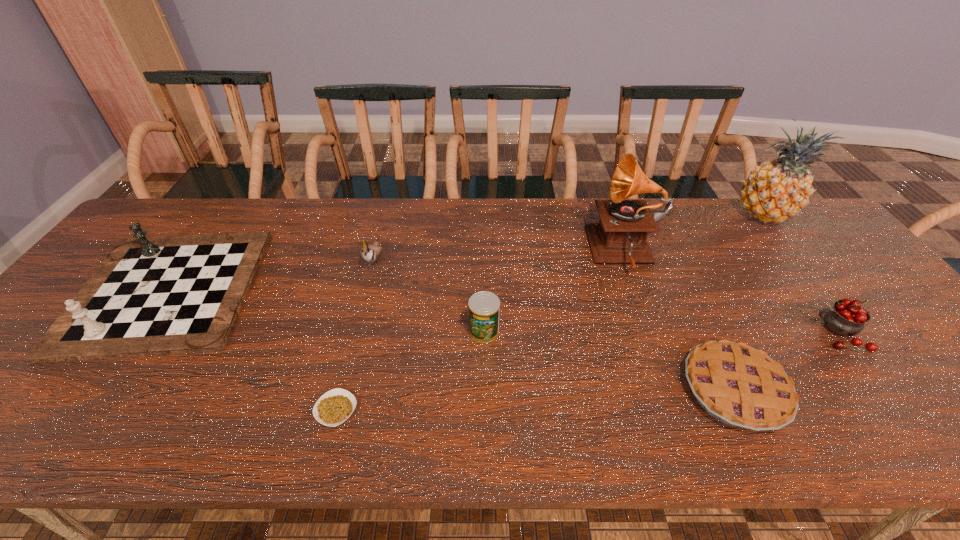
Identify the location of blank space that satisfies the following two spatial constraints: 1. at the face of the can; 2. on the left side of the bird. (356, 330).